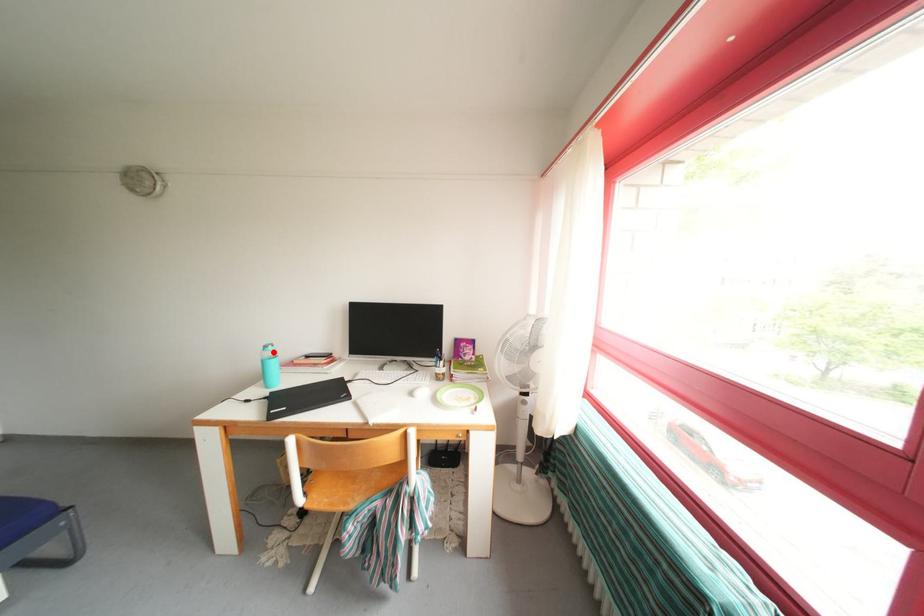
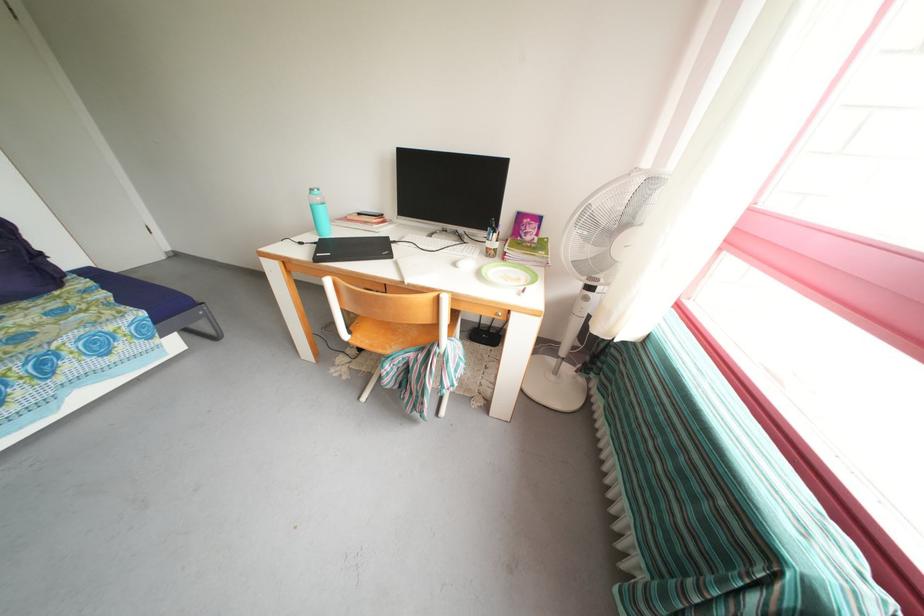
Where in the second image is the point corresponding to the highlighted location from the first image?

(319, 196)